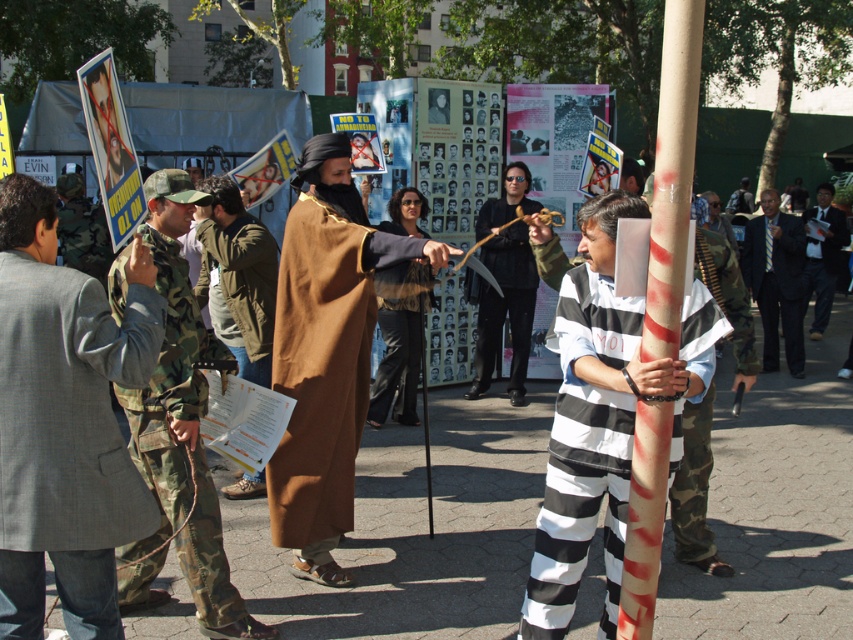
You are a photographer trying to capture both the brown cotton robe at center and the brown suede robe at center in a single frame. Which robe should you focus on to ensure the other is still visible in the background?

You should focus on the brown cotton robe at center because it is taller than the brown suede robe at center, allowing the shorter robe to remain visible in the background.

You are a photographer at the protest scene. You need to capture a photo where both the brown suede jacket at center and the matte black shirt at center are visible. Based on their positions, which one should be framed closer to the bottom of the photo?

The brown suede jacket at center should be framed closer to the bottom of the photo because it is located below the matte black shirt at center.